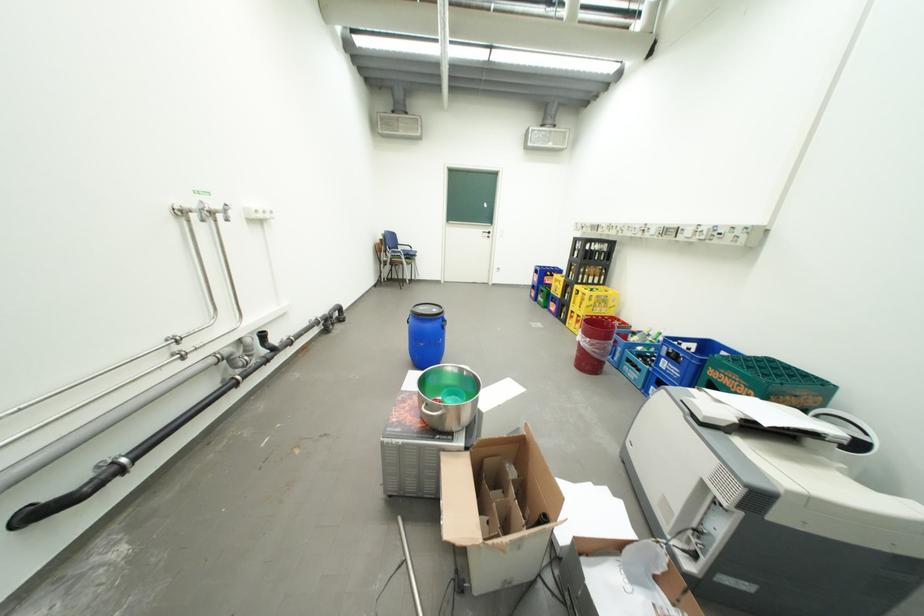
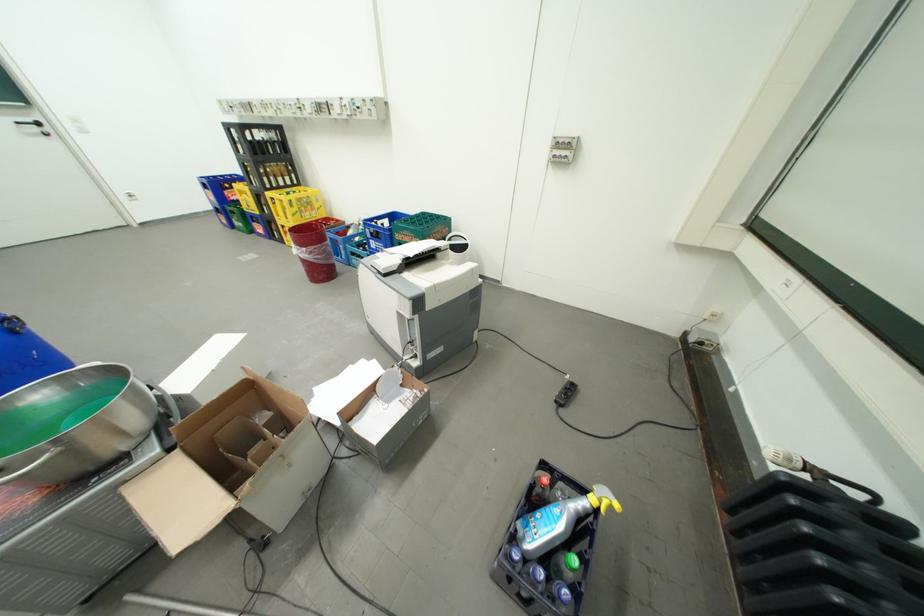
Locate, in the second image, the point that corresponds to point 505,270 in the first image.

(134, 199)